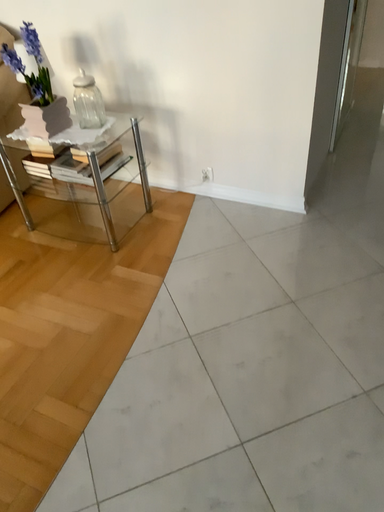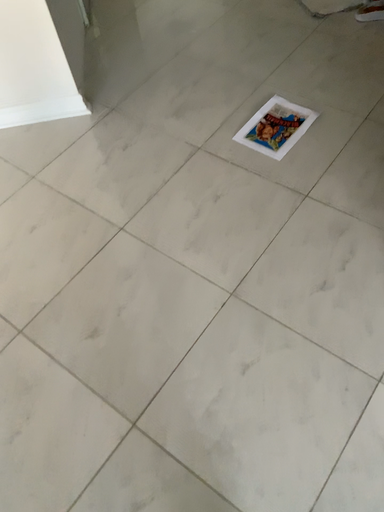
Question: Which way did the camera rotate in the video?

Choices:
 (A) rotated downward
 (B) rotated upward

Answer: (A)